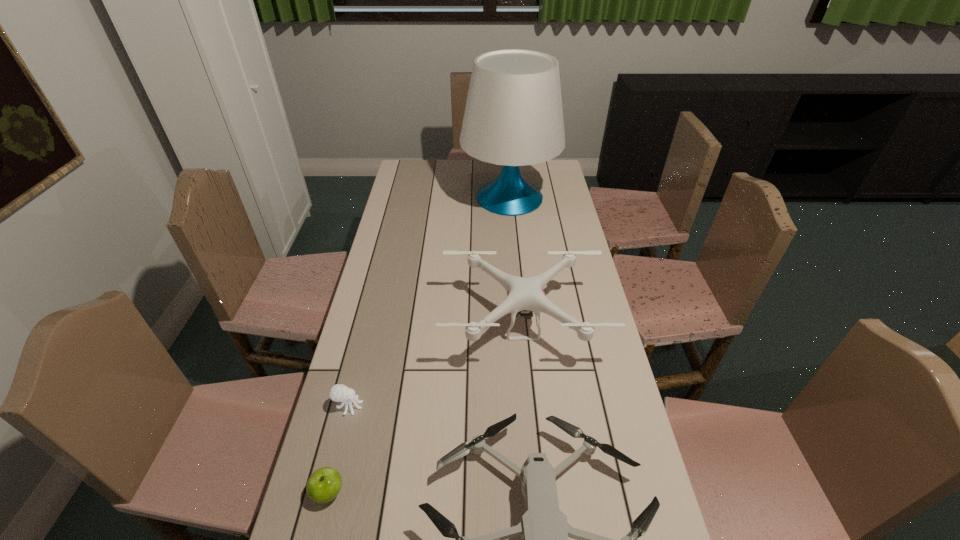
Locate an element on the screen. Image resolution: width=960 pixels, height=540 pixels. vacant space located 0.300m on the right of the apple is located at coordinates (473, 492).

Where is `vacant space located 0.250m on the front-facing side of the octopus`? The image size is (960, 540). vacant space located 0.250m on the front-facing side of the octopus is located at coordinates (454, 406).

At what (x,y) coordinates should I click in order to perform the action: click on object positioned at the far edge. Please return your answer as a coordinate pair (x, y). Looking at the image, I should click on (513, 117).

At what (x,y) coordinates should I click in order to perform the action: click on apple situated at the left edge. Please return your answer as a coordinate pair (x, y). The height and width of the screenshot is (540, 960). Looking at the image, I should click on (324, 484).

The width and height of the screenshot is (960, 540). I want to click on octopus at the left edge, so click(339, 393).

Identify the location of table lamp positioned at the right edge. This screenshot has width=960, height=540. (513, 117).

Identify the location of drone that is at the right edge. Image resolution: width=960 pixels, height=540 pixels. (523, 293).

Where is `object present at the far right corner`? The image size is (960, 540). object present at the far right corner is located at coordinates (513, 117).

Identify the location of vacant space at the far edge of the desktop. (435, 164).

Where is `vacant space at the left edge of the desktop`? The height and width of the screenshot is (540, 960). vacant space at the left edge of the desktop is located at coordinates (337, 424).